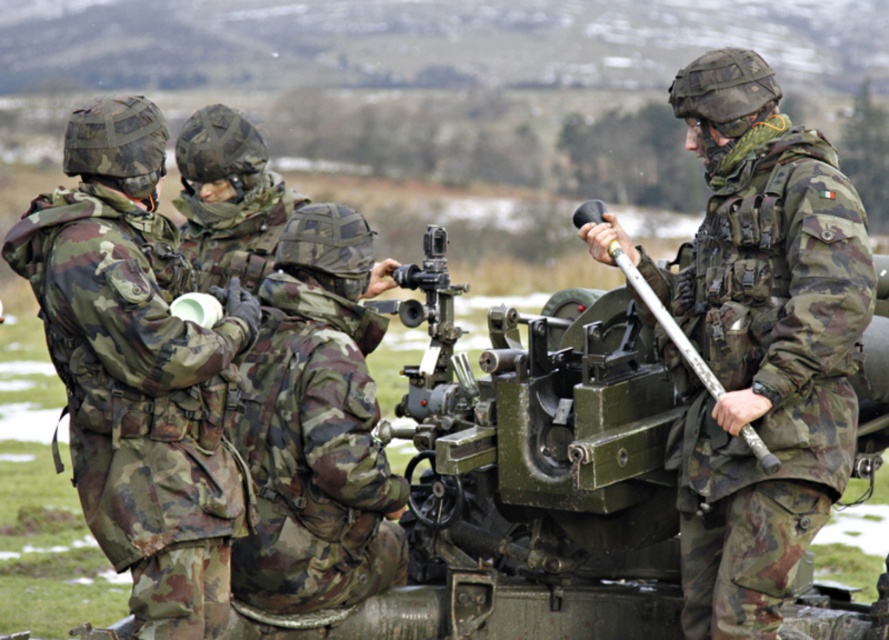
Based on the photo, can you confirm if camouflage fabric helmet at upper right is positioned to the right of camouflage fabric helmet at upper left?

Yes, camouflage fabric helmet at upper right is to the right of camouflage fabric helmet at upper left.

Does camouflage fabric helmet at upper right have a larger size compared to camouflage fabric helmet at upper left?

Yes, camouflage fabric helmet at upper right is bigger than camouflage fabric helmet at upper left.

What do you see at coordinates (757, 340) in the screenshot?
I see `camouflage fabric helmet at upper right` at bounding box center [757, 340].

The image size is (889, 640). Identify the location of camouflage fabric helmet at upper right. (757, 340).

Is camouflage fabric helmet at upper left positioned before camouflage fabric helmet at center?

Yes, camouflage fabric helmet at upper left is closer to the viewer.

Is camouflage fabric helmet at upper left positioned at the back of camouflage fabric helmet at center?

No, camouflage fabric helmet at upper left is in front of camouflage fabric helmet at center.

This screenshot has height=640, width=889. Describe the element at coordinates (138, 371) in the screenshot. I see `camouflage fabric helmet at upper left` at that location.

Where is `camouflage fabric helmet at upper left`? camouflage fabric helmet at upper left is located at coordinates (138, 371).

Is camouflage fabric helmet at upper left positioned before metallic green gun at right?

No, it is behind metallic green gun at right.

Consider the image. Can you confirm if camouflage fabric helmet at upper left is positioned above metallic green gun at right?

Actually, camouflage fabric helmet at upper left is below metallic green gun at right.

Find the location of `camouflage fabric helmet at upper left`. camouflage fabric helmet at upper left is located at coordinates pyautogui.click(x=138, y=371).